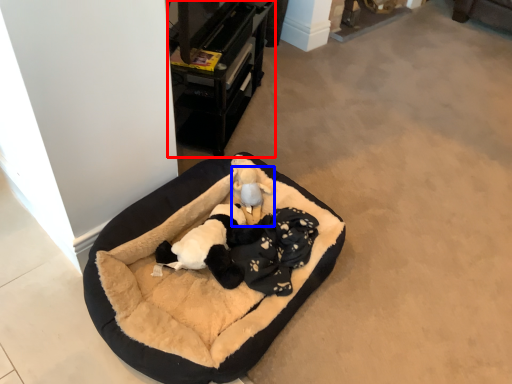
Question: Which of the following is the farthest to the observer, furniture (highlighted by a red box) or toy (highlighted by a blue box)?

Choices:
 (A) furniture
 (B) toy

Answer: (B)